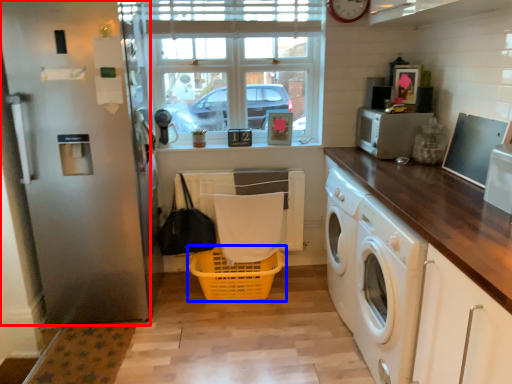
Question: Which point is closer to the camera, screen door (highlighted by a red box) or basket (highlighted by a blue box)?

Choices:
 (A) screen door
 (B) basket

Answer: (A)